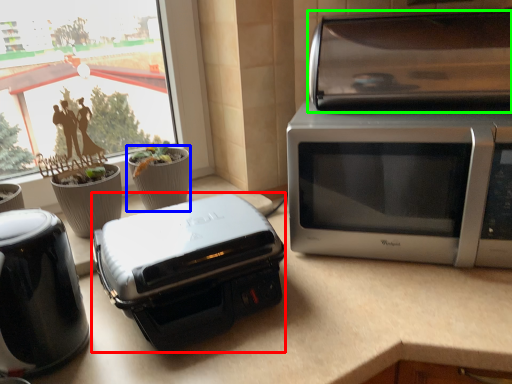
Question: Based on their relative distances, which object is farther from toaster (highlighted by a red box)? Choose from flowerpot (highlighted by a blue box) and stereo (highlighted by a green box).

Choices:
 (A) flowerpot
 (B) stereo

Answer: (B)